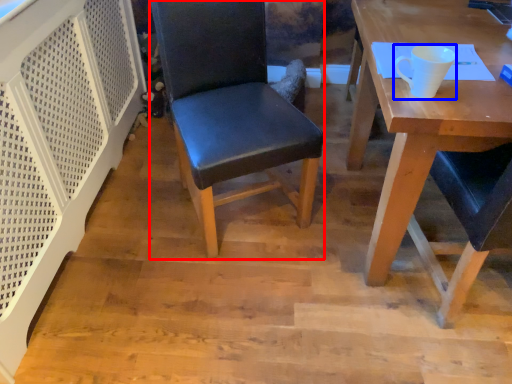
Question: Which object is closer to the camera taking this photo, chair (highlighted by a red box) or coffee cup (highlighted by a blue box)?

Choices:
 (A) chair
 (B) coffee cup

Answer: (B)